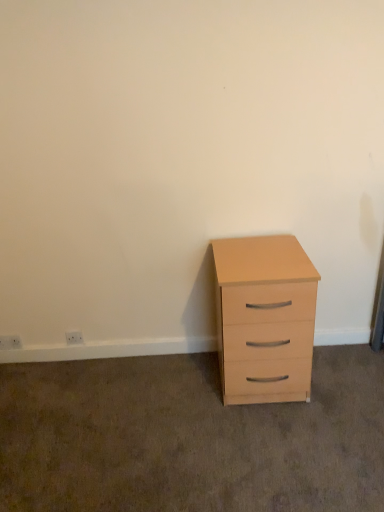
Locate an element on the screen. vacant space in front of light wood chest of drawers at right is located at coordinates (274, 442).